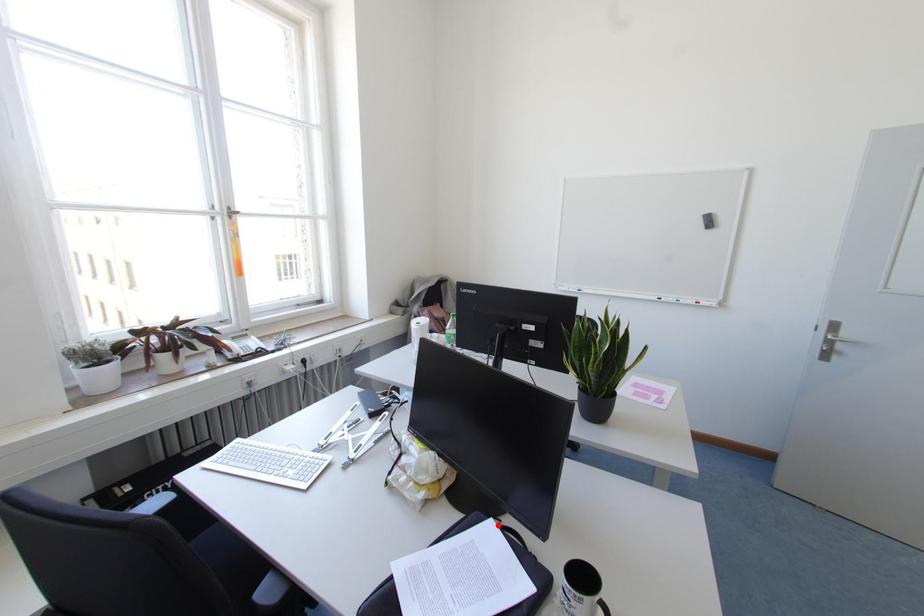
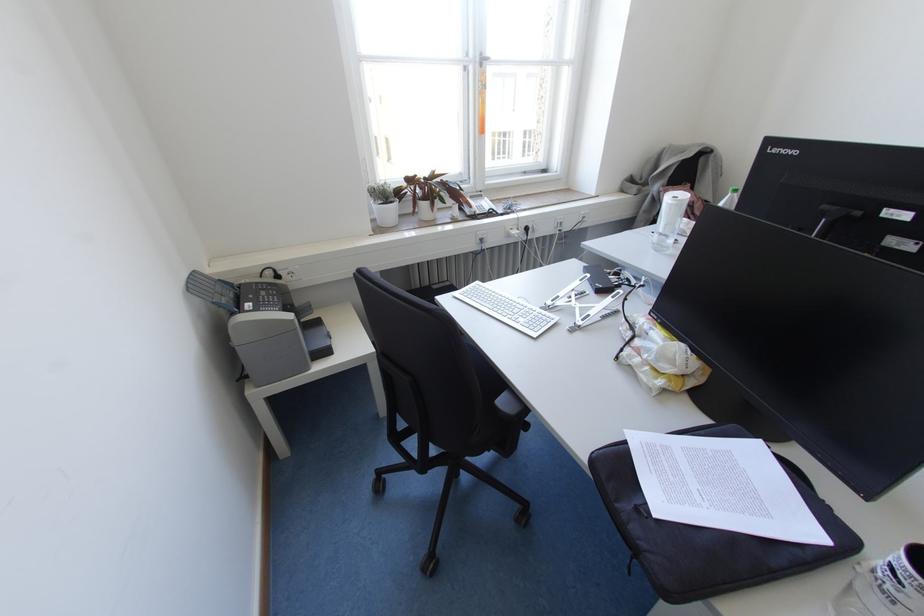
In the second image, find the point that corresponds to the highlighted location in the first image.

(762, 454)